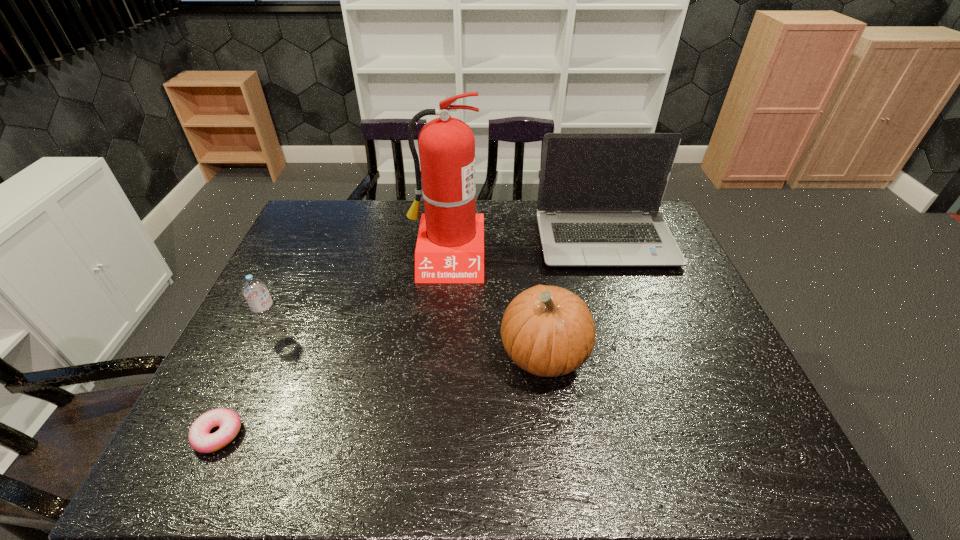
Identify the location of vacant space located on the stem of the pumpkin. (400, 354).

Identify the location of blank area located 0.090m on the stem of the pumpkin. Image resolution: width=960 pixels, height=540 pixels. (464, 354).

Where is `vacant space located on the back of the second shortest object`? The image size is (960, 540). vacant space located on the back of the second shortest object is located at coordinates (312, 249).

Locate an element on the screen. This screenshot has height=540, width=960. vacant region located on the right of the shortest object is located at coordinates (265, 434).

This screenshot has width=960, height=540. Identify the location of fire extinguisher that is positioned at the far edge. pyautogui.click(x=450, y=245).

In order to click on laptop computer at the far edge in this screenshot , I will do `click(599, 195)`.

I want to click on object that is at the near edge, so click(200, 439).

This screenshot has height=540, width=960. What are the coordinates of `water bottle present at the left edge` in the screenshot? It's located at (255, 291).

This screenshot has width=960, height=540. I want to click on doughnut at the left edge, so click(x=200, y=439).

I want to click on object situated at the right edge, so click(x=599, y=195).